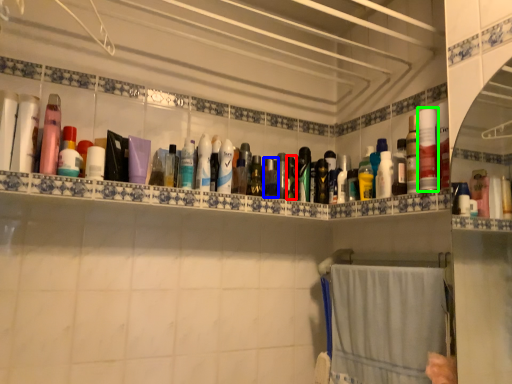
Question: Considering the real-world distances, which object is closest to toiletry (highlighted by a red box)? toiletry (highlighted by a blue box) or toiletry (highlighted by a green box).

Choices:
 (A) toiletry
 (B) toiletry

Answer: (A)